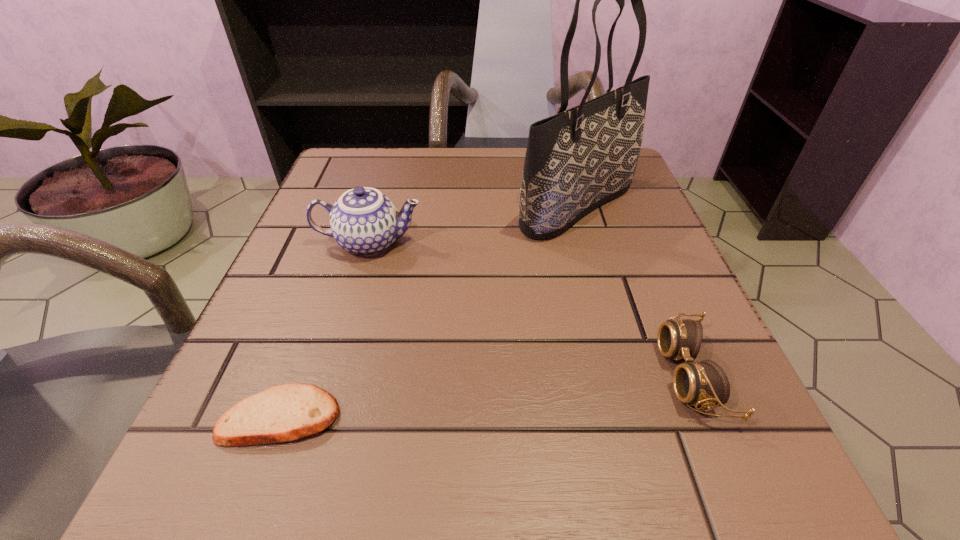
This screenshot has width=960, height=540. In order to click on free space between the second shortest object and the tallest object in this screenshot , I will do `click(635, 291)`.

Locate an element on the screen. empty location between the goggles and the pita bread is located at coordinates (486, 396).

Where is `vacant area that lies between the goggles and the chinaware`? This screenshot has height=540, width=960. vacant area that lies between the goggles and the chinaware is located at coordinates (530, 309).

Where is `vacant region between the tallest object and the shortest object`? vacant region between the tallest object and the shortest object is located at coordinates click(x=429, y=311).

At what (x,y) coordinates should I click in order to perform the action: click on object that is the second nearest to the pita bread. Please return your answer as a coordinate pair (x, y). Looking at the image, I should click on (576, 160).

Identify which object is located as the nearest to the shortest object. Please provide its 2D coordinates. Your answer should be formatted as a tuple, i.e. [(x, y)], where the tuple contains the x and y coordinates of a point satisfying the conditions above.

[(363, 221)]